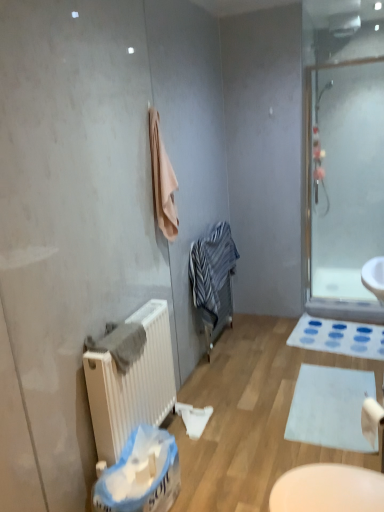
Question: From a real-world perspective, is beige soft towel at upper center, the second bath towel ordered from the bottom, below gray cotton towel at left, which is counted as the 2th bath towel, starting from the back?

Choices:
 (A) no
 (B) yes

Answer: (A)

Question: Is beige soft towel at upper center, which is counted as the first bath towel, starting from the top, further to the viewer compared to gray cotton towel at left, the 1th bath towel in the left-to-right sequence?

Choices:
 (A) no
 (B) yes

Answer: (B)

Question: Does beige soft towel at upper center, the second bath towel ordered from the bottom, have a greater height compared to gray cotton towel at left, positioned as the 2th bath towel in top-to-bottom order?

Choices:
 (A) yes
 (B) no

Answer: (A)

Question: From the image's perspective, is beige soft towel at upper center, which is counted as the first bath towel, starting from the right, located above gray cotton towel at left, which is counted as the 1th bath towel, starting from the bottom?

Choices:
 (A) yes
 (B) no

Answer: (A)

Question: Can you confirm if beige soft towel at upper center, which ranks as the 2th bath towel in front-to-back order, is thinner than gray cotton towel at left, the 1th bath towel in the left-to-right sequence?

Choices:
 (A) no
 (B) yes

Answer: (B)

Question: Considering the relative sizes of beige soft towel at upper center, which ranks as the 2th bath towel in front-to-back order, and gray cotton towel at left, acting as the first bath towel starting from the front, in the image provided, is beige soft towel at upper center, which ranks as the 2th bath towel in front-to-back order, wider than gray cotton towel at left, acting as the first bath towel starting from the front,?

Choices:
 (A) no
 (B) yes

Answer: (A)

Question: Is white matte toilet paper at lower right aimed at striped cotton bathrobe at center?

Choices:
 (A) yes
 (B) no

Answer: (B)

Question: Is white matte toilet paper at lower right taller than striped cotton bathrobe at center?

Choices:
 (A) no
 (B) yes

Answer: (A)

Question: Is white matte toilet paper at lower right completely or partially outside of striped cotton bathrobe at center?

Choices:
 (A) yes
 (B) no

Answer: (A)

Question: Is white matte toilet paper at lower right smaller than striped cotton bathrobe at center?

Choices:
 (A) no
 (B) yes

Answer: (B)

Question: From a real-world perspective, does white matte toilet paper at lower right stand above striped cotton bathrobe at center?

Choices:
 (A) no
 (B) yes

Answer: (A)

Question: Can you confirm if white matte toilet paper at lower right is thinner than striped cotton bathrobe at center?

Choices:
 (A) no
 (B) yes

Answer: (B)

Question: From a real-world perspective, is blue plastic laundry basket at lower center physically above beige soft towel at upper center, which is counted as the 2th bath towel, starting from the left?

Choices:
 (A) no
 (B) yes

Answer: (A)